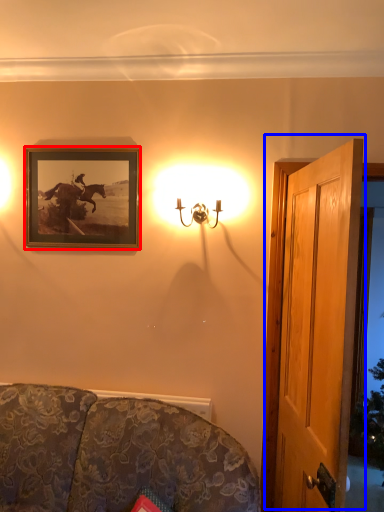
Question: Which object appears closest to the camera in this image, picture frame (highlighted by a red box) or door (highlighted by a blue box)?

Choices:
 (A) picture frame
 (B) door

Answer: (B)